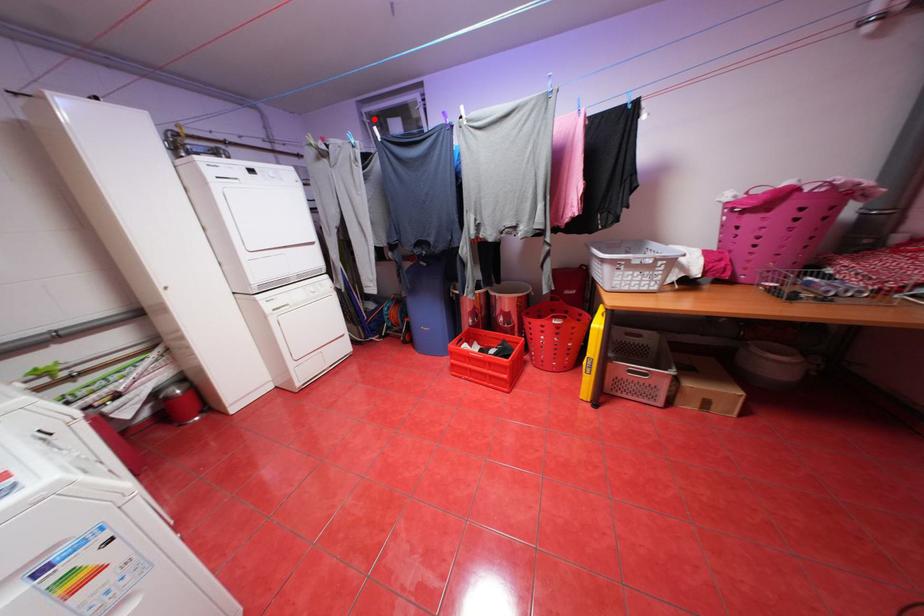
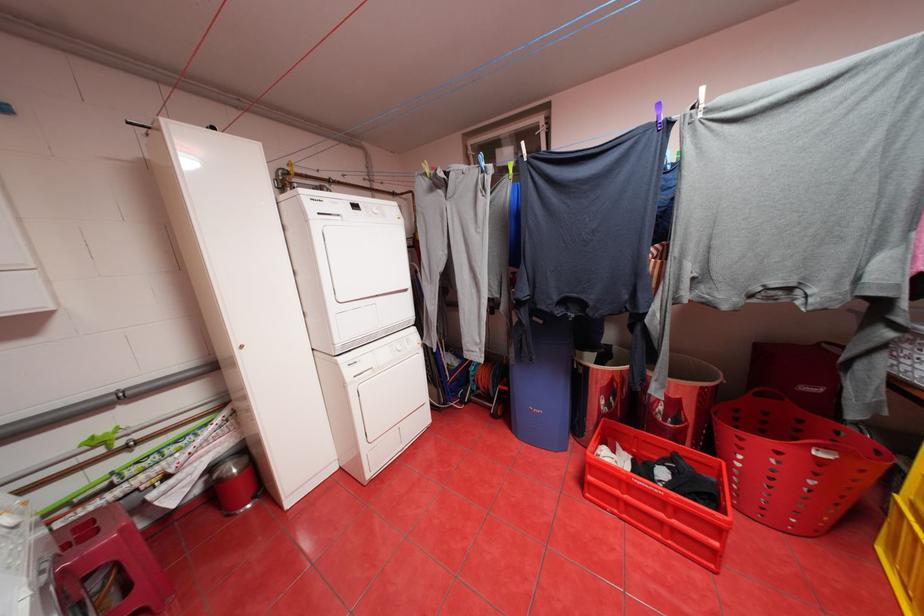
In the second image, find the point that corresponds to the highlighted location in the first image.

(479, 152)